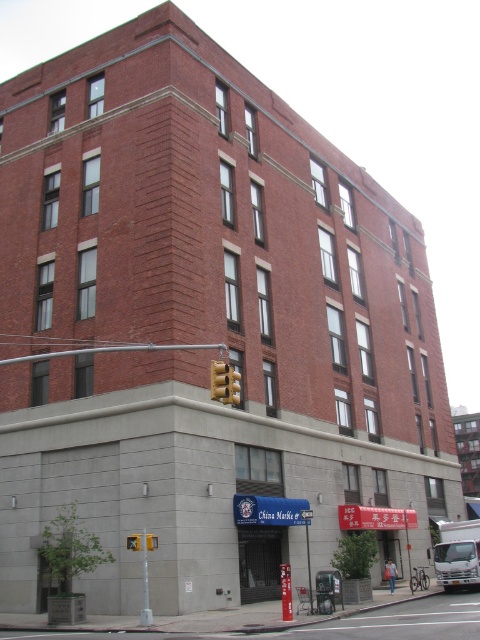
Question: Can you confirm if yellow matte traffic light at upper center is bigger than yellow plastic traffic light at upper center?

Choices:
 (A) no
 (B) yes

Answer: (B)

Question: Is yellow matte traffic light at upper center below yellow plastic traffic light at lower center?

Choices:
 (A) yes
 (B) no

Answer: (B)

Question: Does yellow matte traffic light at upper center appear on the left side of yellow plastic traffic light at upper center?

Choices:
 (A) no
 (B) yes

Answer: (A)

Question: Which of the following is the farthest from the observer?

Choices:
 (A) yellow plastic traffic light at lower center
 (B) yellow plastic traffic light at upper center

Answer: (A)

Question: Which point is farther to the camera?

Choices:
 (A) yellow plastic traffic light at upper center
 (B) yellow plastic traffic light at lower center
 (C) yellow matte traffic light at upper center

Answer: (B)

Question: Which point is farther from the camera taking this photo?

Choices:
 (A) (147, 547)
 (B) (222, 374)
 (C) (136, 538)

Answer: (C)